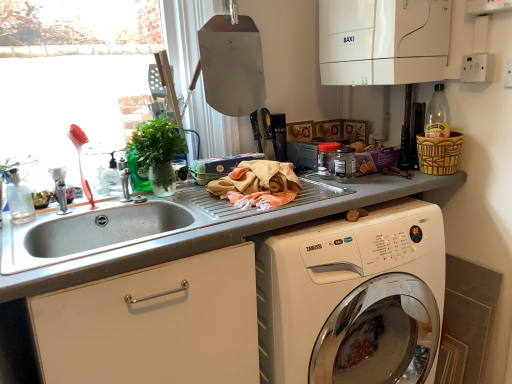
Find the location of a particular element. The height and width of the screenshot is (384, 512). free space in front of transparent glass jar at center, which is the third appliance in top-to-bottom order is located at coordinates (351, 195).